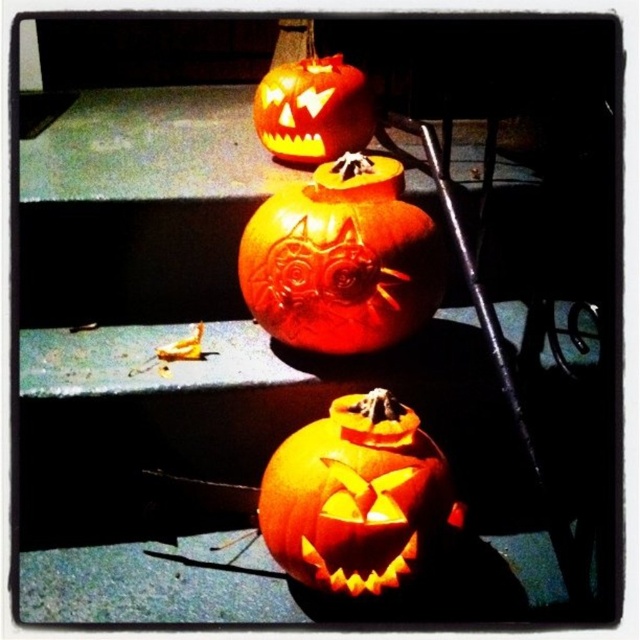
From the picture: Is orange matte pumpkin at center positioned behind matte orange pumpkin at upper center?

That is False.

This screenshot has width=640, height=640. In order to click on orange matte pumpkin at center in this screenshot , I will do `click(355, 496)`.

Between orange carved pumpkin at center and matte orange pumpkin at upper center, which one is positioned lower?

Positioned lower is orange carved pumpkin at center.

Is point (324, 300) less distant than point (307, 134)?

That is True.

Identify the location of orange carved pumpkin at center. The image size is (640, 640). coord(340,259).

Does orange carved pumpkin at center lie behind orange matte pumpkin at center?

Yes, orange carved pumpkin at center is further from the viewer.

Between point (401, 209) and point (307, 451), which one is positioned behind?

The point (401, 209) is more distant.

Looking at this image, measure the distance between point (362, 300) and camera.

Point (362, 300) is 3.82 feet from camera.

Locate an element on the screen. orange carved pumpkin at center is located at coordinates (340, 259).